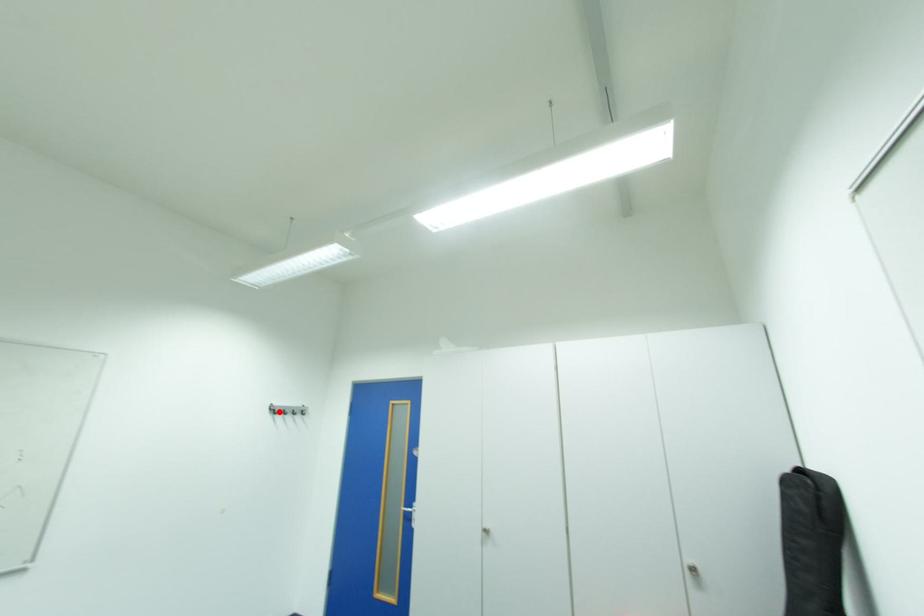
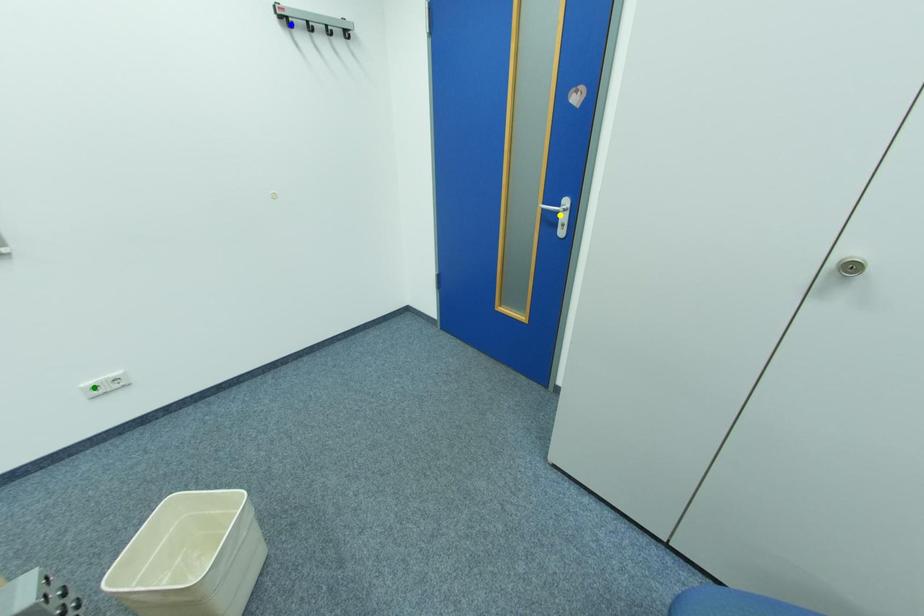
Question: I am providing you with two images of the same scene from different viewpoints. A red point is marked on the first image. You are given multiple points on the second image. Can you choose the point in image 2 that corresponds to the point in image 1?

Choices:
 (A) blue point
 (B) yellow point
 (C) green point

Answer: (A)